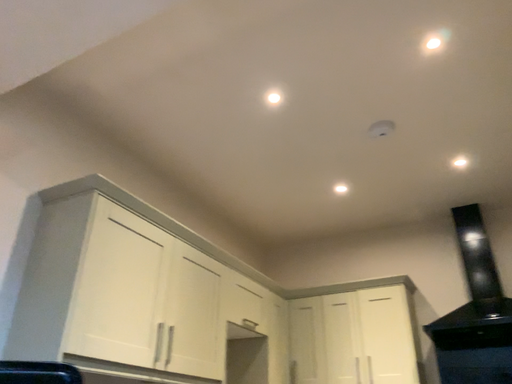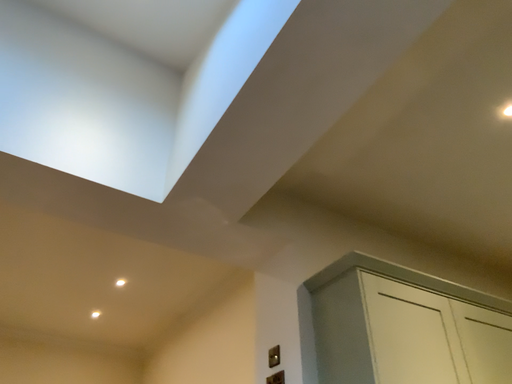
Question: Which way did the camera rotate in the video?

Choices:
 (A) rotated left
 (B) rotated right

Answer: (A)